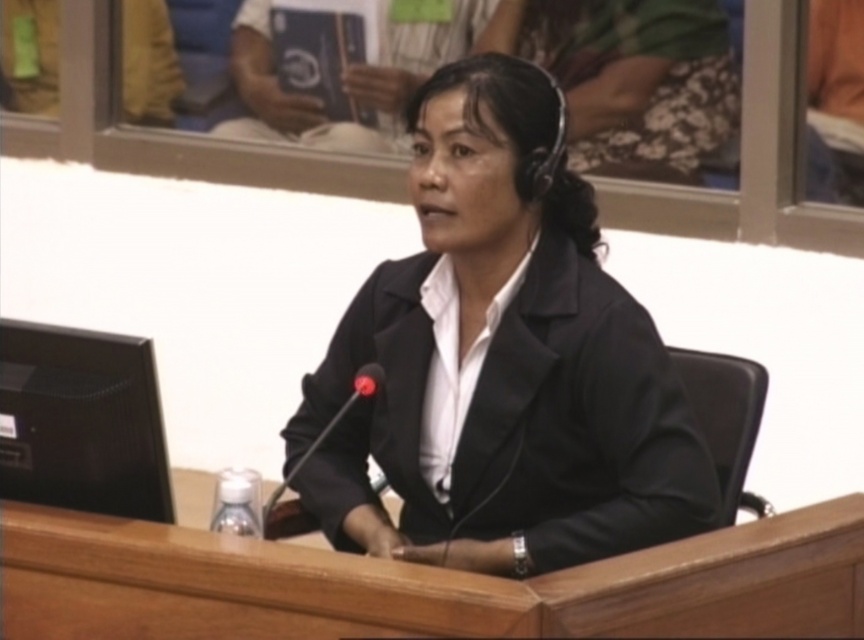
Question: Is black matte suit at center smaller than black plastic microphone at center?

Choices:
 (A) no
 (B) yes

Answer: (A)

Question: Does black matte suit at center come behind black plastic microphone at center?

Choices:
 (A) yes
 (B) no

Answer: (A)

Question: Can you confirm if black matte suit at center is positioned above black plastic microphone at center?

Choices:
 (A) yes
 (B) no

Answer: (A)

Question: Which of the following is the farthest from the observer?

Choices:
 (A) (564, 552)
 (B) (376, 385)

Answer: (B)